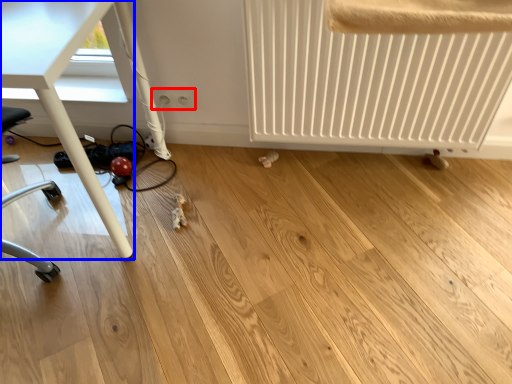
Question: Which of the following is the closest to the observer, electric outlet (highlighted by a red box) or table (highlighted by a blue box)?

Choices:
 (A) electric outlet
 (B) table

Answer: (B)